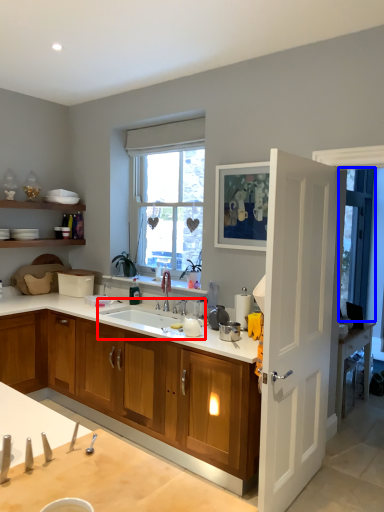
Question: Which of the following is the closest to the observer, sink (highlighted by a red box) or window screen (highlighted by a blue box)?

Choices:
 (A) sink
 (B) window screen

Answer: (A)